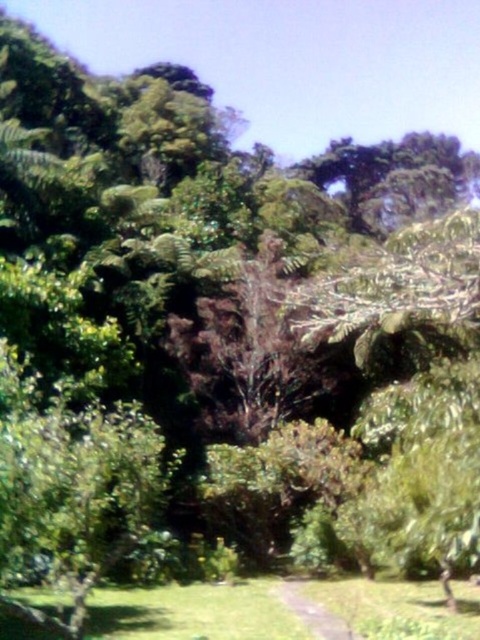
In the scene shown: You are standing at the point marked as point [194,612] in the lower center of the forest scene. What is the name of the object you are currently standing on?

You are standing on the green grass at lower center located at point [194,612].

You are a hiker trying to find the narrowest path through the forest. You see two areas of green grass at lower center and green grassy path at center. Which area has a narrower width?

The green grassy path at center has a narrower width than the green grass at lower center.